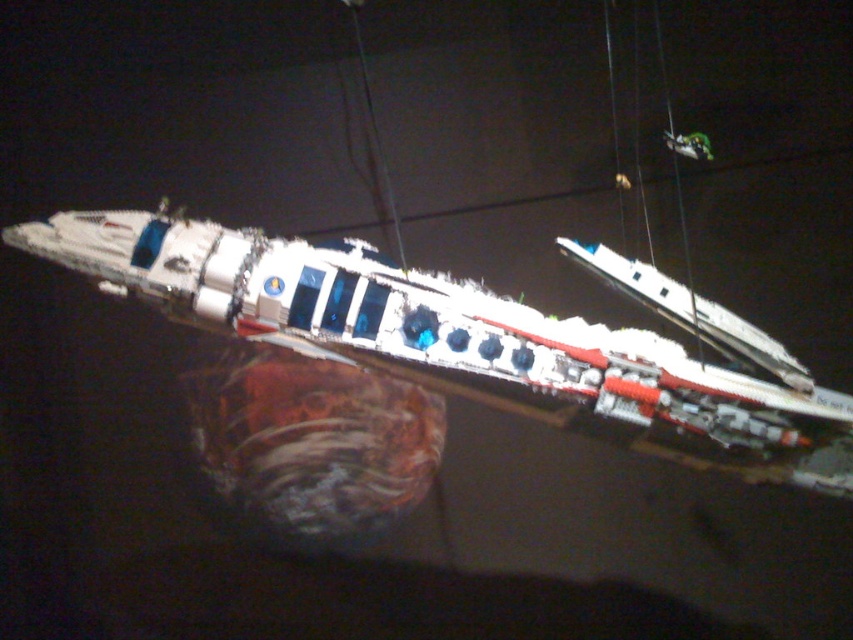
Question: Is white plastic boat at center thinner than green plastic toy at upper right?

Choices:
 (A) yes
 (B) no

Answer: (B)

Question: Is white plastic boat at center positioned behind green plastic toy at upper right?

Choices:
 (A) yes
 (B) no

Answer: (B)

Question: Which object appears farthest from the camera in this image?

Choices:
 (A) white plastic boat at center
 (B) green plastic toy at upper right

Answer: (B)

Question: Among these points, which one is nearest to the camera?

Choices:
 (A) (683, 148)
 (B) (426, 291)

Answer: (B)

Question: Where is white plastic boat at center located in relation to green plastic toy at upper right in the image?

Choices:
 (A) below
 (B) above

Answer: (A)